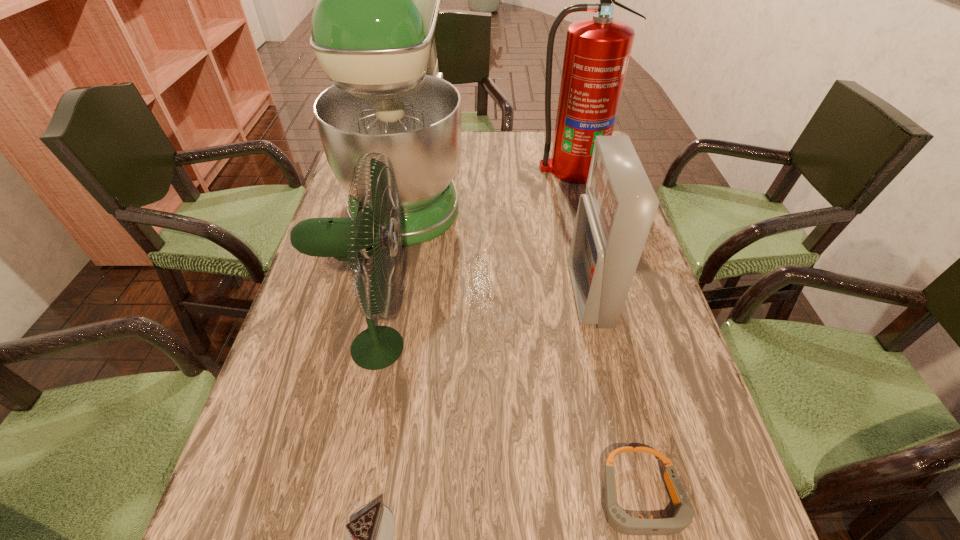
Find the location of `vacant space at the right edge`. vacant space at the right edge is located at coordinates (626, 309).

The width and height of the screenshot is (960, 540). Find the location of `free space between the mixer and the first-aid kit`. free space between the mixer and the first-aid kit is located at coordinates (499, 241).

The width and height of the screenshot is (960, 540). Identify the location of free area in between the fan and the third shortest object. click(482, 321).

Locate an element on the screen. The width and height of the screenshot is (960, 540). free space between the fire extinguisher and the fan is located at coordinates (474, 258).

Locate an element on the screen. The height and width of the screenshot is (540, 960). object that is the third nearest to the first-aid kit is located at coordinates (597, 51).

This screenshot has width=960, height=540. I want to click on object identified as the closest to the goggles, so click(x=614, y=217).

Image resolution: width=960 pixels, height=540 pixels. Identify the location of free space that satisfies the following two spatial constraints: 1. on the instruction side of the fire extinguisher; 2. on the front-facing side of the third tallest object. (620, 348).

Find the location of a particular element. This screenshot has height=540, width=960. vacant area in the image that satisfies the following two spatial constraints: 1. on the instruction side of the fire extinguisher; 2. on the front-facing side of the fan is located at coordinates (620, 348).

I want to click on free location that satisfies the following two spatial constraints: 1. on the instruction side of the fire extinguisher; 2. on the front-facing side of the fourth tallest object, so click(606, 295).